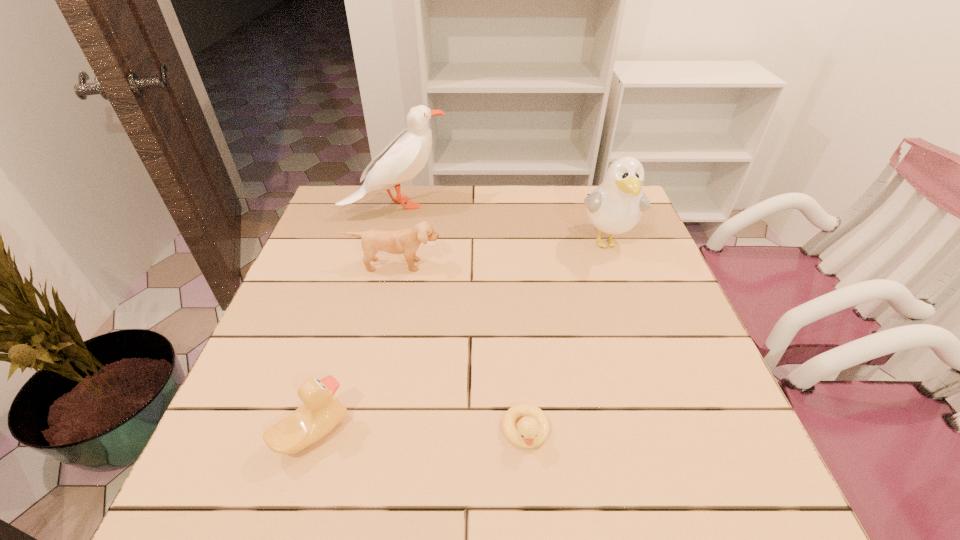
Locate an element on the screen. The height and width of the screenshot is (540, 960). the farther gull is located at coordinates (406, 155).

At what (x,y) coordinates should I click in order to perform the action: click on the farthest object. Please return your answer as a coordinate pair (x, y). This screenshot has height=540, width=960. Looking at the image, I should click on (406, 155).

Find the location of a particular element. The width and height of the screenshot is (960, 540). the right gull is located at coordinates (616, 205).

Identify the location of the nearer gull. The height and width of the screenshot is (540, 960). (616, 205).

Identify the location of puppy. (406, 241).

The width and height of the screenshot is (960, 540). Identify the location of duck. (321, 411).

Find the location of a particular element. duckling is located at coordinates (533, 429).

Image resolution: width=960 pixels, height=540 pixels. I want to click on the second object from right to left, so click(x=533, y=429).

Locate an element on the screen. This screenshot has width=960, height=540. vacant region located at the beak of the farthest object is located at coordinates (533, 205).

Find the location of a particular element. Image resolution: width=960 pixels, height=540 pixels. free space located 0.340m on the beak of the right gull is located at coordinates (652, 370).